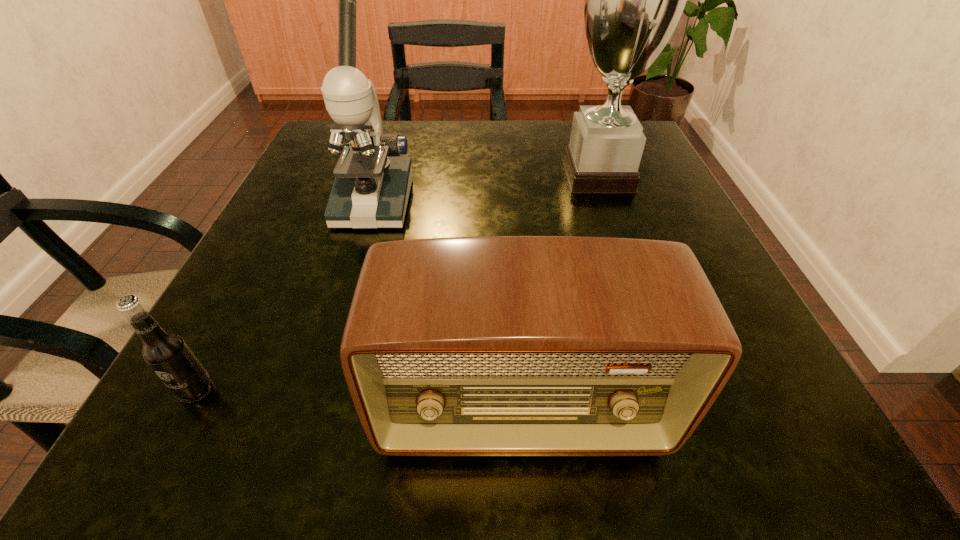
The height and width of the screenshot is (540, 960). I want to click on vacant space that satisfies the following two spatial constraints: 1. at the front view of the tallest object; 2. on the label of the root beer, so click(676, 390).

Find the location of a particular element. The height and width of the screenshot is (540, 960). free space that satisfies the following two spatial constraints: 1. at the front view of the tallest object; 2. on the front-facing side of the radio receiver is located at coordinates (684, 412).

I want to click on vacant region that satisfies the following two spatial constraints: 1. at the front view of the tallest object; 2. on the label of the shortest object, so click(676, 390).